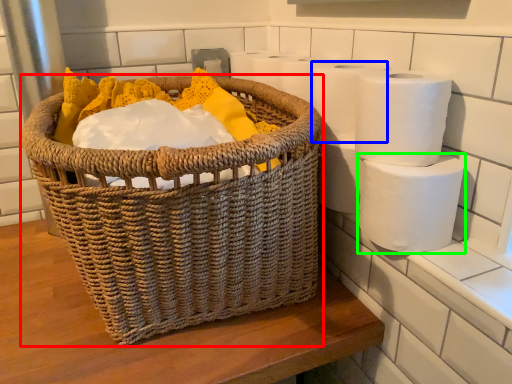
Question: Which is farther away from picnic basket (highlighted by a red box)? toilet paper (highlighted by a blue box) or toilet paper (highlighted by a green box)?

Choices:
 (A) toilet paper
 (B) toilet paper

Answer: (B)